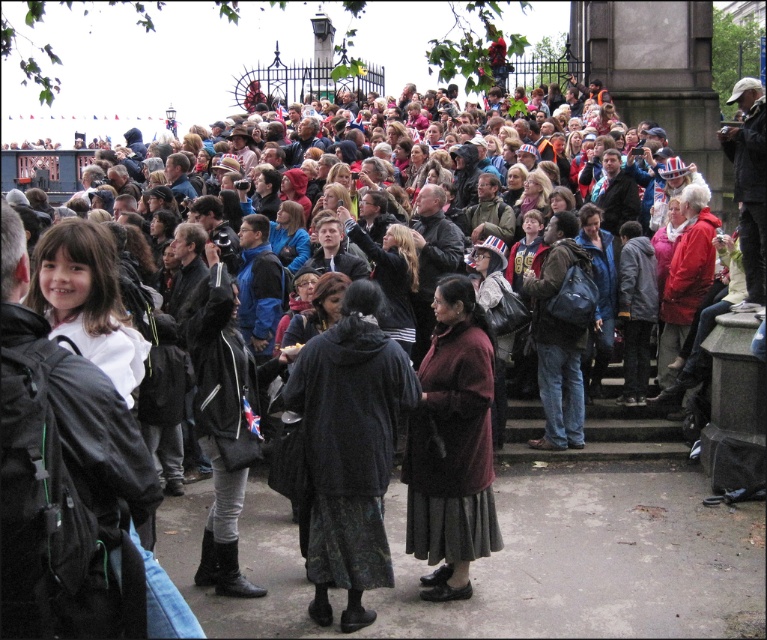
Question: Which object appears closest to the camera in this image?

Choices:
 (A) dark brown leather jacket at center
 (B) matte blue jacket at center

Answer: (A)

Question: Does maroon wool coat at center appear on the left side of matte blue jacket at center?

Choices:
 (A) no
 (B) yes

Answer: (A)

Question: Can you confirm if maroon wool coat at center is positioned to the right of matte blue jacket at center?

Choices:
 (A) yes
 (B) no

Answer: (A)

Question: Which of the following is the closest to the observer?

Choices:
 (A) (387, 244)
 (B) (293, 230)
 (C) (413, 422)

Answer: (C)

Question: Considering the real-world distances, which object is closest to the matte blue jacket at center?

Choices:
 (A) maroon wool coat at center
 (B) dark brown leather jacket at center

Answer: (B)

Question: In this image, where is dark brown leather jacket at center located relative to matte blue jacket at center?

Choices:
 (A) below
 (B) above

Answer: (A)